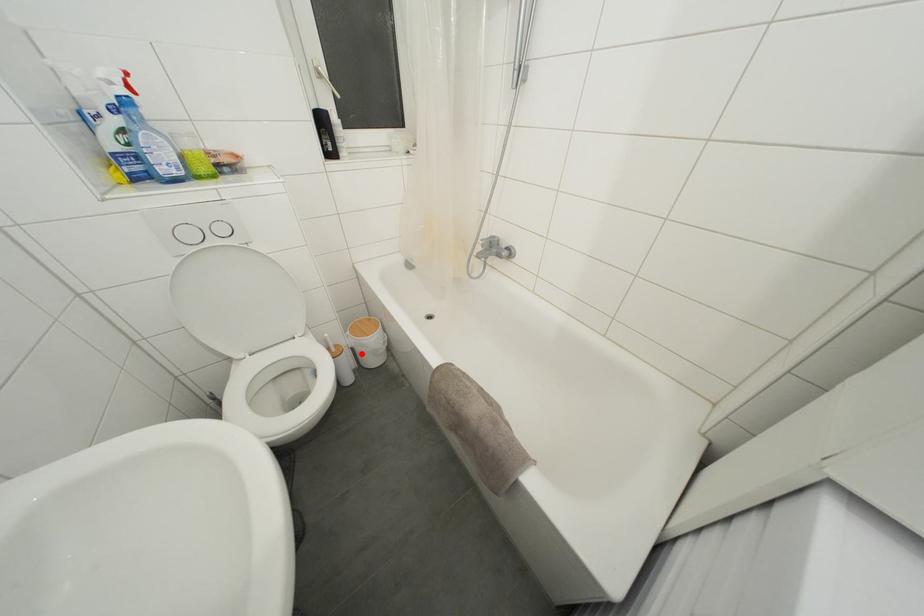
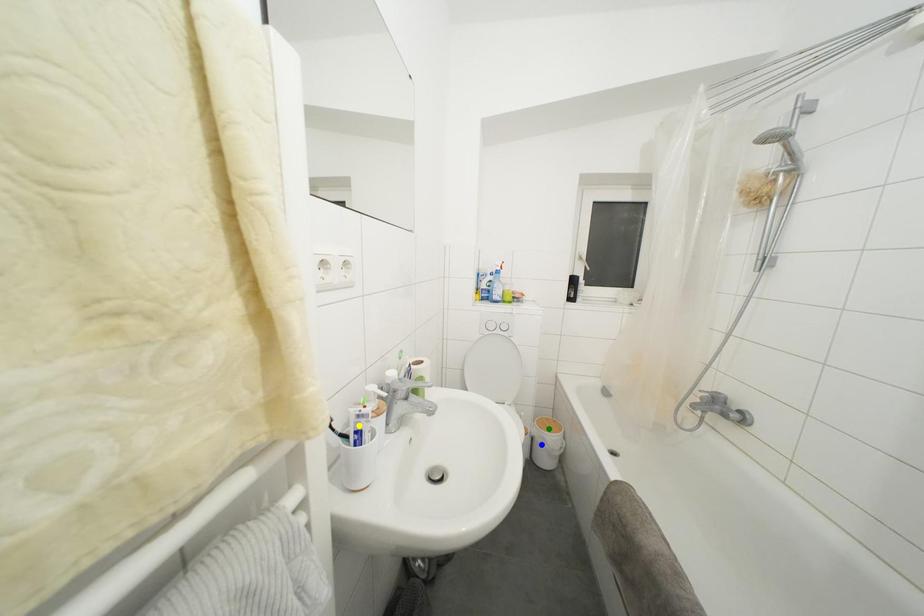
Question: I am providing you with two images of the same scene from different viewpoints. A red point is marked on the first image. You are given multiple points on the second image. In image 2, which mark is for the same physical point as the one in image 1?

Choices:
 (A) green point
 (B) blue point
 (C) yellow point

Answer: (B)